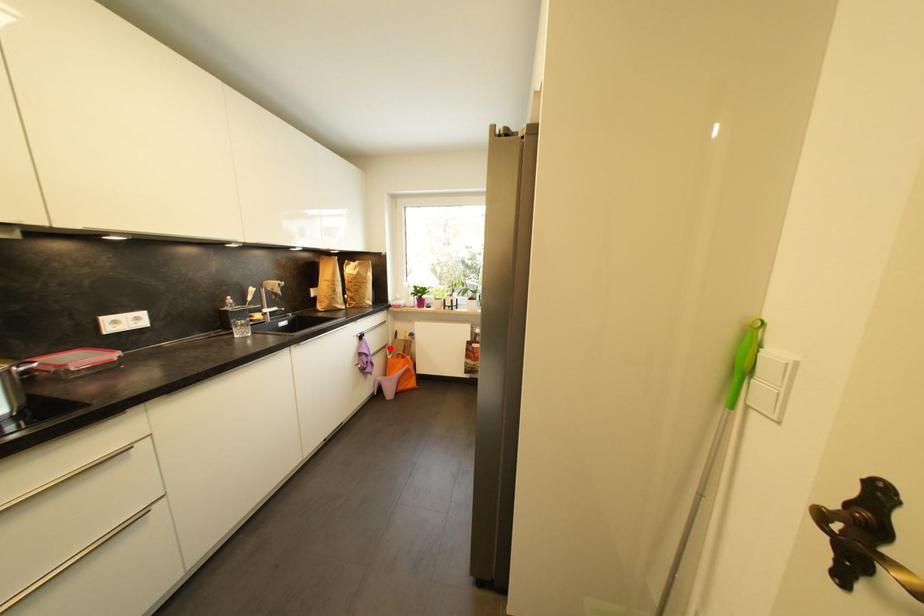
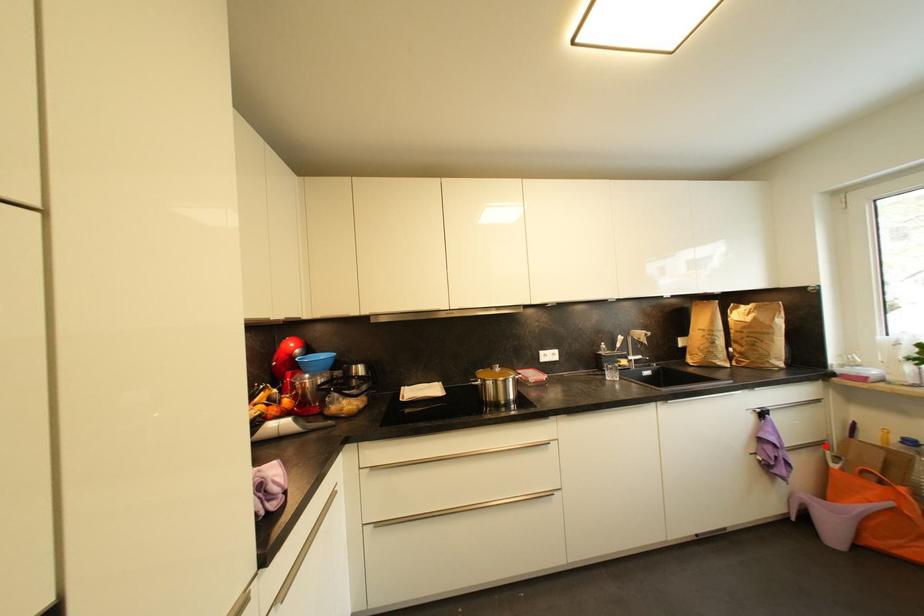
I am providing you with two images of the same scene from different viewpoints. A red point is marked on the first image and another point is marked on the second image. Do the highlighted points in image1 and image2 indicate the same real-world spot?

Yes